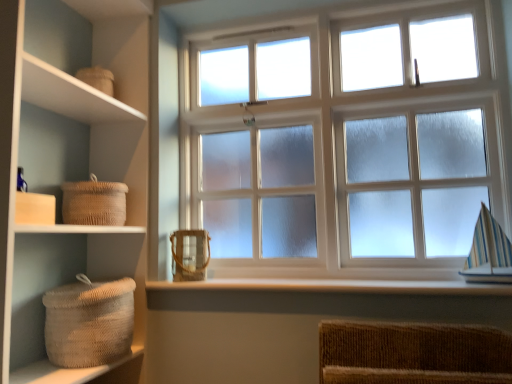
Question: From the image's perspective, relative to woven natural fiber basket at left, which is the 1th basket from top to bottom, is white smooth wood at lower center above or below?

Choices:
 (A) above
 (B) below

Answer: (B)

Question: Is white smooth wood at lower center spatially inside woven natural fiber basket at left, which is the 1th basket from top to bottom, or outside of it?

Choices:
 (A) inside
 (B) outside

Answer: (B)

Question: Considering the real-world distances, which object is closest to the brown woven basket at center, which is the second basket from top to bottom?

Choices:
 (A) woven natural fiber basket at left, acting as the 3th basket starting from the bottom
 (B) beige woven basket at left
 (C) woven beige basket at lower left, the first basket in the bottom-to-top sequence
 (D) frosted glass window at center
 (E) white smooth wood at lower center

Answer: (E)

Question: Considering the real-world distances, which object is farthest from the beige woven basket at left?

Choices:
 (A) white smooth wood at lower center
 (B) woven natural fiber basket at left, which is the 1th basket from top to bottom
 (C) woven beige basket at lower left, the 3th basket when ordered from top to bottom
 (D) frosted glass window at center
 (E) brown woven basket at center, which is counted as the second basket, starting from the bottom

Answer: (D)